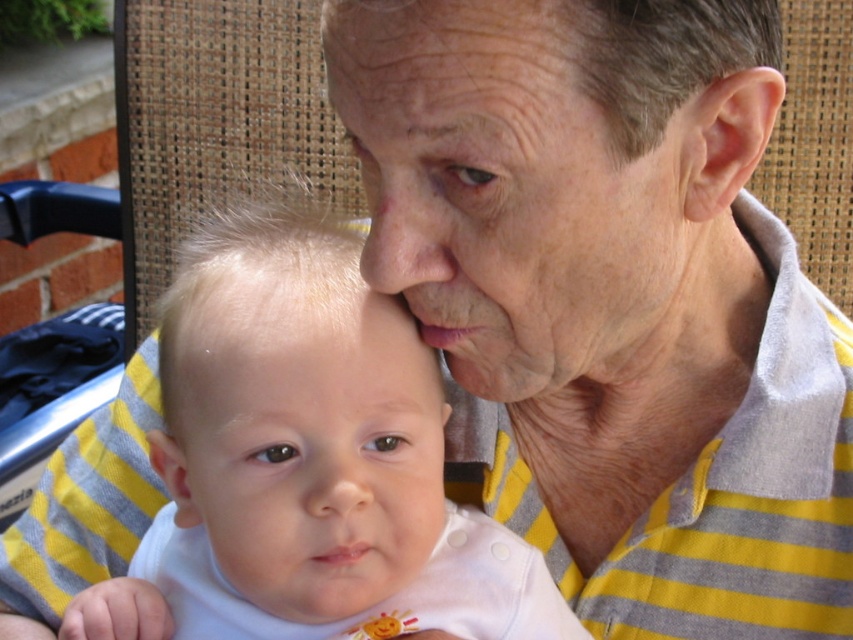
You are a photographer trying to capture a closeup shot of the baby in the image. You notice two distinct areas on the baby that are labeled as the white soft fabric baby at center and the smooth white baby at center. Given the distance between them, would you be able to focus on both areas simultaneously in a single shot without adjusting the camera settings?

The distance between the white soft fabric baby at center and the smooth white baby at center is 0.76 inches. Since this distance is relatively small, it is likely that both areas can be in focus in a single shot without needing to adjust the camera settings, provided the camera has a sufficient depth of field.

You are a photographer setting up a photo shoot in a garden. You have a white soft fabric baby at center and a dry skin at center in your frame. Which object is taller in the scene?

The white soft fabric baby at center is taller than the dry skin at center.